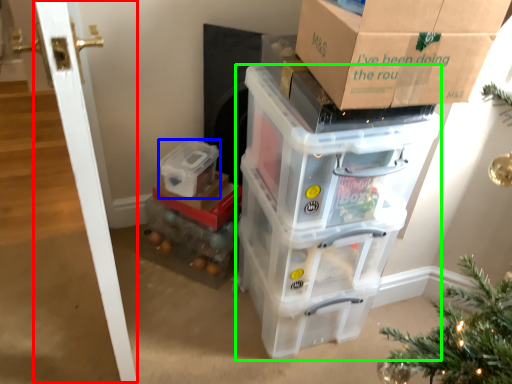
Question: Based on their relative distances, which object is nearer to door (highlighted by a red box)? Choose from storage box (highlighted by a blue box) and storage box (highlighted by a green box).

Choices:
 (A) storage box
 (B) storage box

Answer: (B)